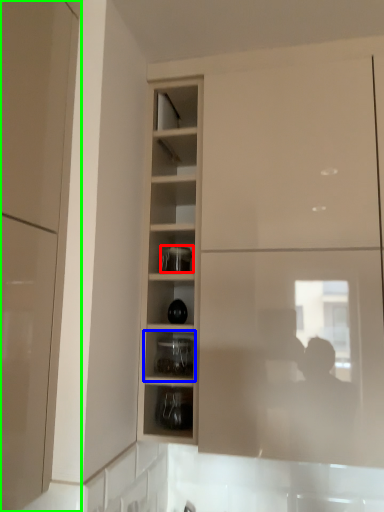
Question: Considering the real-world distances, which object is closest to appliance (highlighted by a red box)? shelf (highlighted by a blue box) or cabinetry (highlighted by a green box).

Choices:
 (A) shelf
 (B) cabinetry

Answer: (A)